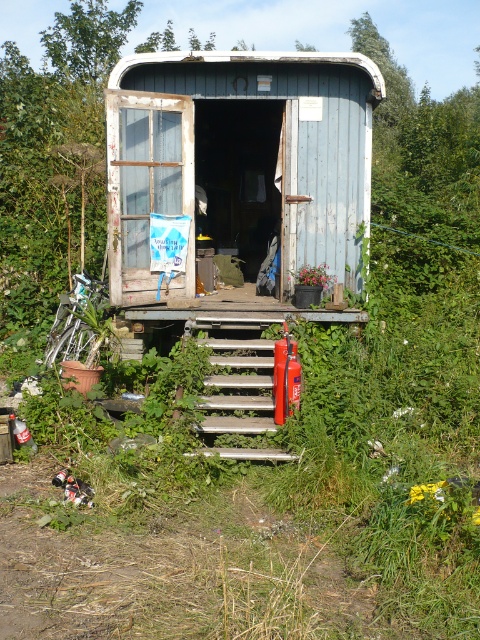
Question: Can you confirm if metallic silver stairs at center is positioned below red matte fire extinguisher at center?

Choices:
 (A) no
 (B) yes

Answer: (B)

Question: Does metallic silver stairs at center have a larger size compared to red matte extinguisher at center?

Choices:
 (A) yes
 (B) no

Answer: (A)

Question: Which of the following is the farthest from the observer?

Choices:
 (A) (292, 394)
 (B) (294, 387)
 (C) (186, 321)
 (D) (308, 97)

Answer: (D)

Question: Which point appears farthest from the camera in this image?

Choices:
 (A) (190, 113)
 (B) (278, 364)
 (C) (288, 396)

Answer: (A)

Question: Is metallic silver stairs at center above red matte extinguisher at center?

Choices:
 (A) no
 (B) yes

Answer: (A)

Question: Which is nearer to the red matte fire extinguisher at center?

Choices:
 (A) red matte extinguisher at center
 (B) wooden cabin at center
 (C) metallic silver stairs at center

Answer: (A)